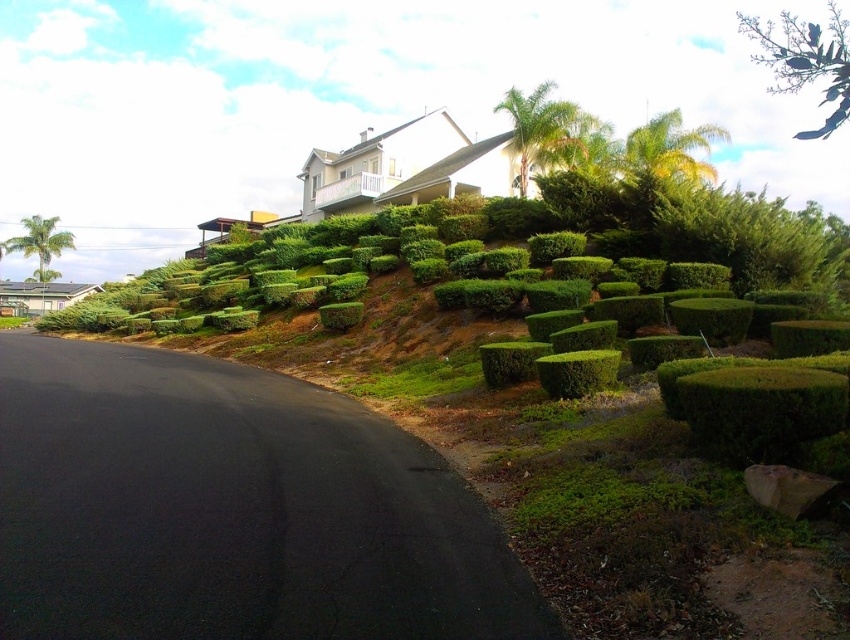
Question: Which point is closer to the camera?

Choices:
 (A) (537, 100)
 (B) (8, 246)
 (C) (697, 182)

Answer: (C)

Question: Which point is farther to the camera?

Choices:
 (A) (544, 145)
 (B) (700, 138)

Answer: (B)

Question: Observing the image, what is the correct spatial positioning of yellow-green leafy palm tree at upper right in reference to green leafy palm tree at upper right?

Choices:
 (A) below
 (B) above

Answer: (A)

Question: Which object is closer to the camera taking this photo?

Choices:
 (A) green leafy palm tree at upper right
 (B) green leafy palm tree at left

Answer: (A)

Question: Considering the relative positions of yellow-green leafy palm tree at upper right and green leafy palm tree at left in the image provided, where is yellow-green leafy palm tree at upper right located with respect to green leafy palm tree at left?

Choices:
 (A) left
 (B) right

Answer: (B)

Question: Does green leafy palm tree at upper right have a greater width compared to green leafy palm tree at left?

Choices:
 (A) no
 (B) yes

Answer: (A)